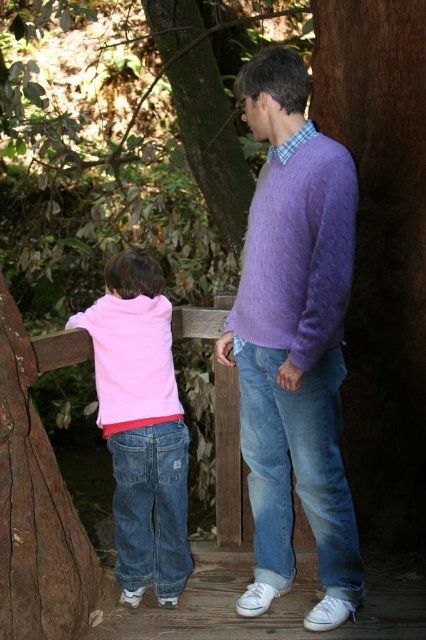
Looking at this image, can you confirm if purple wool sweater at center is wider than purple fuzzy sweater at center?

Yes, purple wool sweater at center is wider than purple fuzzy sweater at center.

Is purple wool sweater at center above purple fuzzy sweater at center?

No, purple wool sweater at center is not above purple fuzzy sweater at center.

This screenshot has height=640, width=426. In order to click on purple wool sweater at center in this screenshot , I will do `click(293, 340)`.

Between purple wool sweater at center and pink fleece jacket at lower left, which one has less height?

pink fleece jacket at lower left

Is purple wool sweater at center below pink fleece jacket at lower left?

Incorrect, purple wool sweater at center is not positioned below pink fleece jacket at lower left.

What do you see at coordinates (293, 340) in the screenshot? I see `purple wool sweater at center` at bounding box center [293, 340].

You are a GUI agent. You are given a task and a screenshot of the screen. Output one action in this format:
    pyautogui.click(x=<x>, y=<y>)
    Task: Click on the purple wool sweater at center
    
    Given the screenshot: What is the action you would take?
    pyautogui.click(x=293, y=340)

Is pink fleece jacket at lower left positioned before purple fuzzy sweater at center?

No.

Does point (164, 560) lie behind point (334, 289)?

Yes, it is.

Identify the location of pink fleece jacket at lower left. (141, 428).